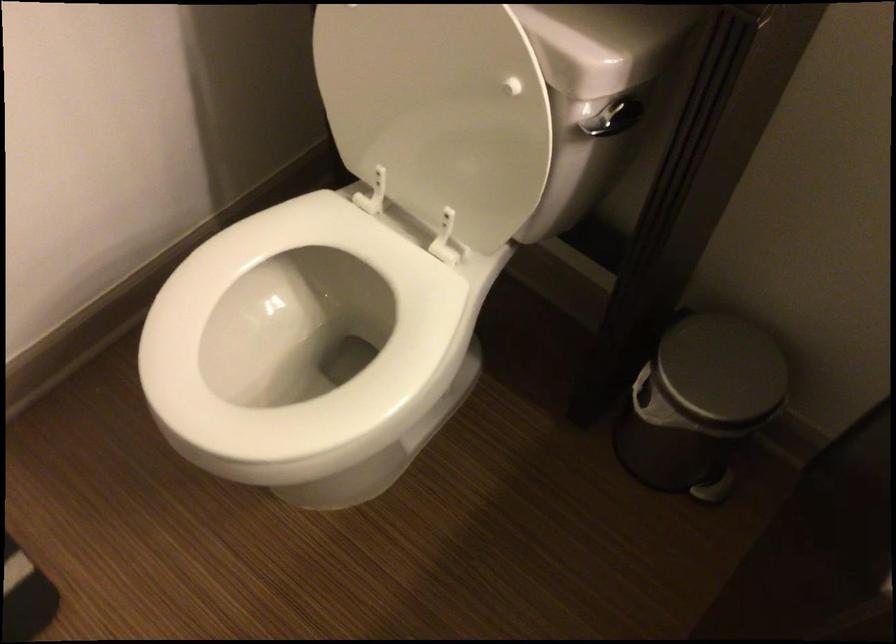
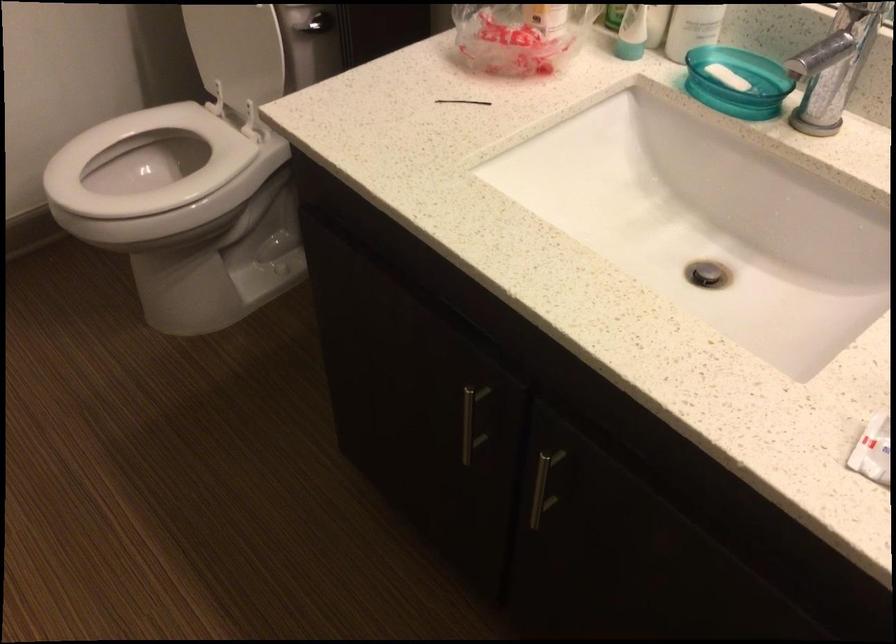
In the second image, find the point that corresponds to the point at 435,142 in the first image.

(237, 51)